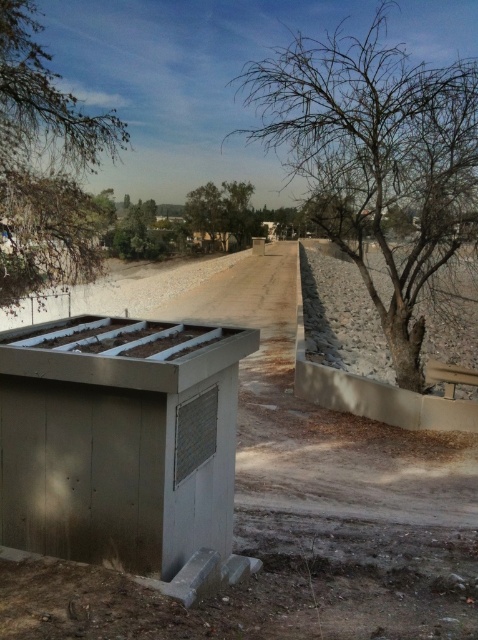
Is point (193, 216) behind point (276, 227)?

No.

Can you confirm if green leafy tree at center is shorter than matte gray hut at center?

No, green leafy tree at center is not shorter than matte gray hut at center.

Between point (207, 198) and point (271, 236), which one is positioned behind?

Positioned behind is point (271, 236).

Find the location of a particular element. green leafy tree at center is located at coordinates [x=223, y=212].

Who is positioned more to the right, metallic gray hut at center or green leafy tree at upper left?

Answer: metallic gray hut at center

Which is in front, point (143, 364) or point (97, 256)?

Point (143, 364) is more forward.

Where is `metallic gray hut at center`? This screenshot has width=478, height=640. metallic gray hut at center is located at coordinates (123, 445).

Is metallic gray hut at center positioned behind green leafy tree at center?

No.

Who is more forward, (159,419) or (198,204)?

A: Point (159,419) is in front.

The image size is (478, 640). What are the coordinates of `metallic gray hut at center` in the screenshot? It's located at (123, 445).